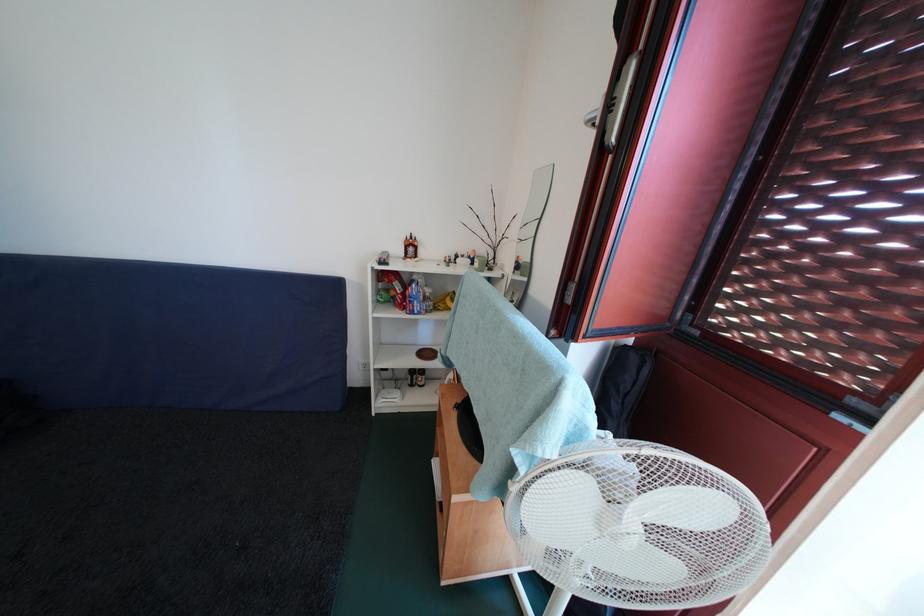
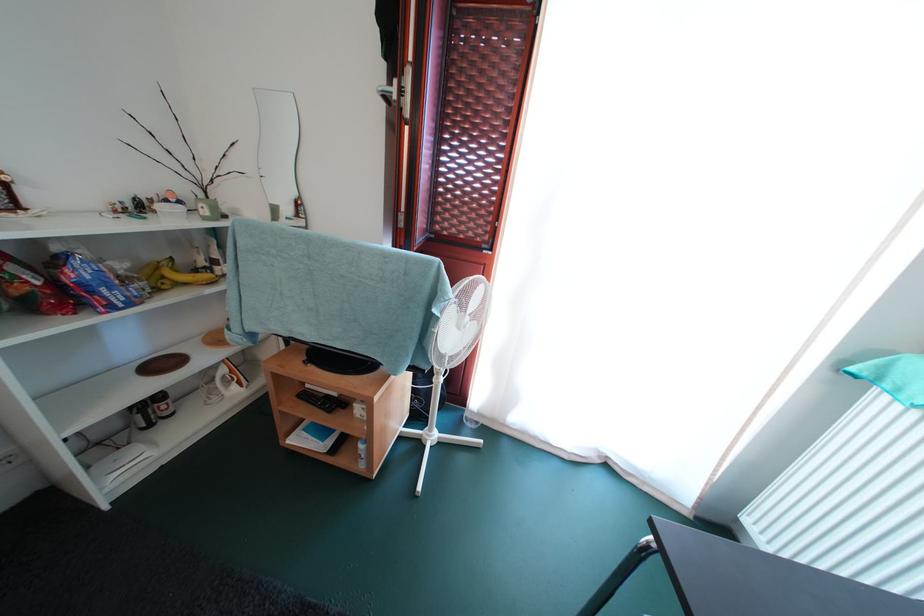
Find the pixel in the second image that matches point (432, 304) in the first image.

(131, 285)